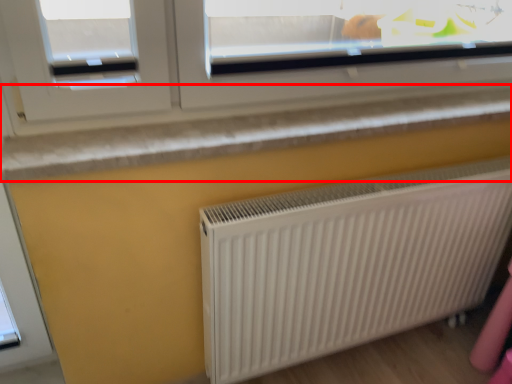
Question: Where is window sill (annotated by the red box) located in relation to radiator in the image?

Choices:
 (A) right
 (B) left

Answer: (B)